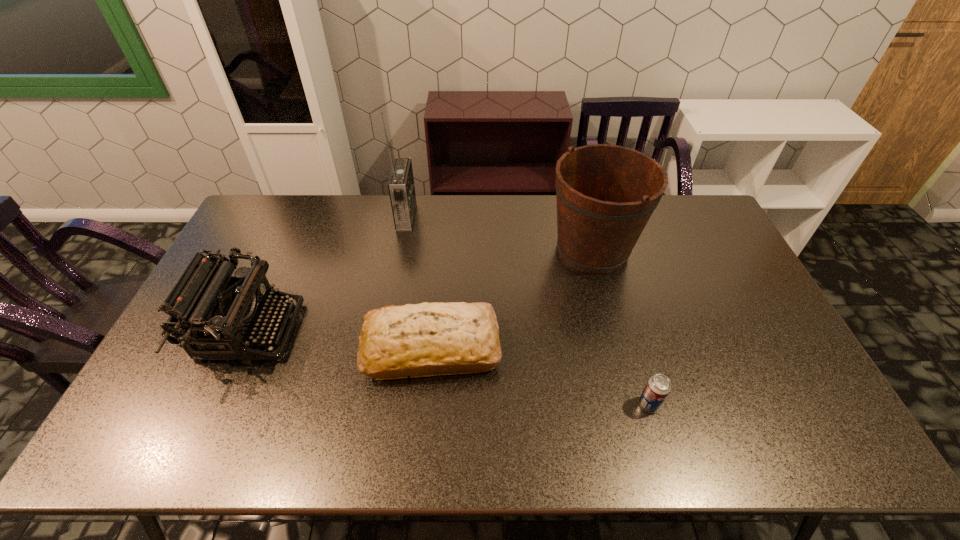
This screenshot has height=540, width=960. Find the location of `radio receiver`. radio receiver is located at coordinates (401, 187).

I want to click on the fourth shortest object, so click(x=605, y=194).

Locate an element on the screen. The height and width of the screenshot is (540, 960). the third shortest object is located at coordinates (219, 316).

What are the coordinates of `the leftmost object` in the screenshot? It's located at [x=219, y=316].

Find the location of a particular element. Image resolution: width=960 pixels, height=540 pixels. bread is located at coordinates (428, 339).

Find the location of a particular element. The height and width of the screenshot is (540, 960). beer can is located at coordinates (658, 387).

Identify the location of the nearest object. (658, 387).

Identify the location of free space located 0.270m on the display of the radio receiver. The width and height of the screenshot is (960, 540). (488, 217).

Locate an element on the screen. This screenshot has height=540, width=960. vacant space situated on the left of the second tallest object is located at coordinates (513, 250).

This screenshot has height=540, width=960. I want to click on vacant space located 0.350m on the keyboard of the third shortest object, so click(418, 330).